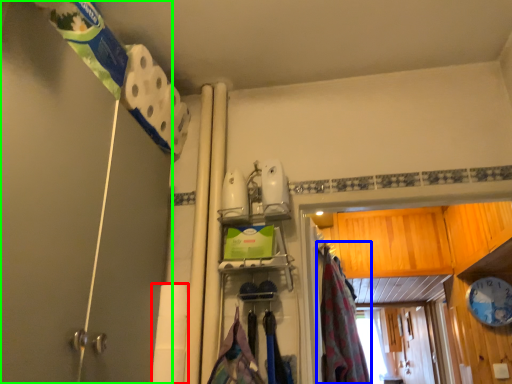
Question: Estimate the real-world distances between objects in this image. Which object is farther from toilet paper (highlighted by a red box), curtain (highlighted by a blue box) or shower door (highlighted by a green box)?

Choices:
 (A) curtain
 (B) shower door

Answer: (A)